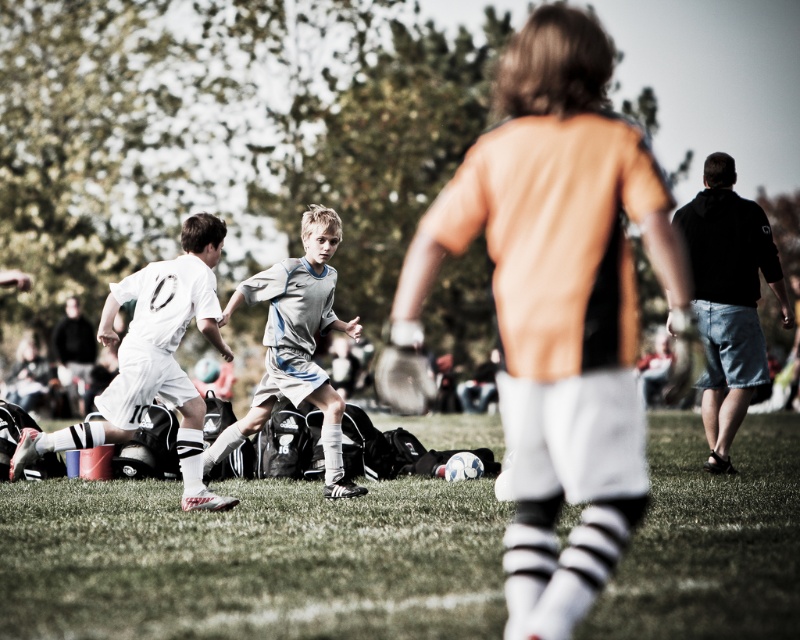
You are a referee watching the soccer match. You notice two players in orange matte jersey at center and gray matte soccer jersey at center. Which player is positioned to the right side of the other?

The orange matte jersey at center is to the right of the gray matte soccer jersey at center.

You are a referee observing the soccer match. You notice two players in the center of the field wearing orange matte jersey at center and gray matte soccer jersey at center. Which player do you think has a larger jersey size?

The orange matte jersey at center is bigger than the gray matte soccer jersey at center, so the player wearing the orange matte jersey at center has a larger jersey size.

You are a referee watching the soccer match. You notice two points marked on the field at coordinates point (x=548, y=566) and point (x=744, y=362). Which point is closer to the direction the ball is moving towards?

Point (x=548, y=566) is in front of point (x=744, y=362), so the ball is moving towards point (x=548, y=566).